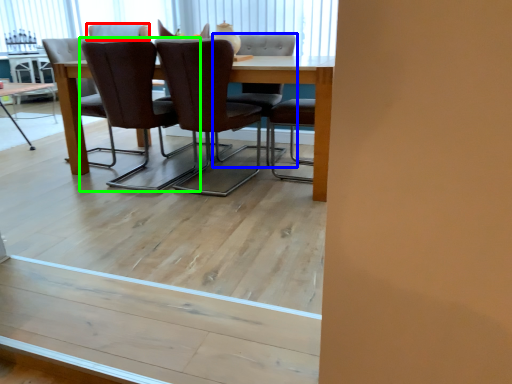
Question: Which object is the farthest from chair (highlighted by a red box)? Choose among these: chair (highlighted by a blue box) or chair (highlighted by a green box).

Choices:
 (A) chair
 (B) chair

Answer: (A)